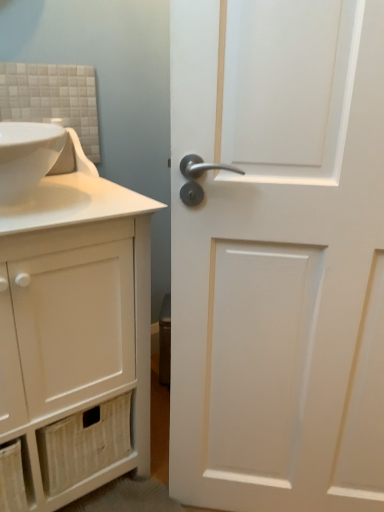
Question: Is white matte door at right inside or outside of white matte cabinet at left?

Choices:
 (A) outside
 (B) inside

Answer: (A)

Question: From a real-world perspective, is white matte door at right physically located above or below white matte cabinet at left?

Choices:
 (A) above
 (B) below

Answer: (A)

Question: Which object is positioned closest to the white matte cabinet at left?

Choices:
 (A) white matte door at right
 (B) white glossy sink at upper left

Answer: (A)

Question: Considering the real-world distances, which object is farthest from the white matte door at right?

Choices:
 (A) white matte cabinet at left
 (B) white glossy sink at upper left

Answer: (B)